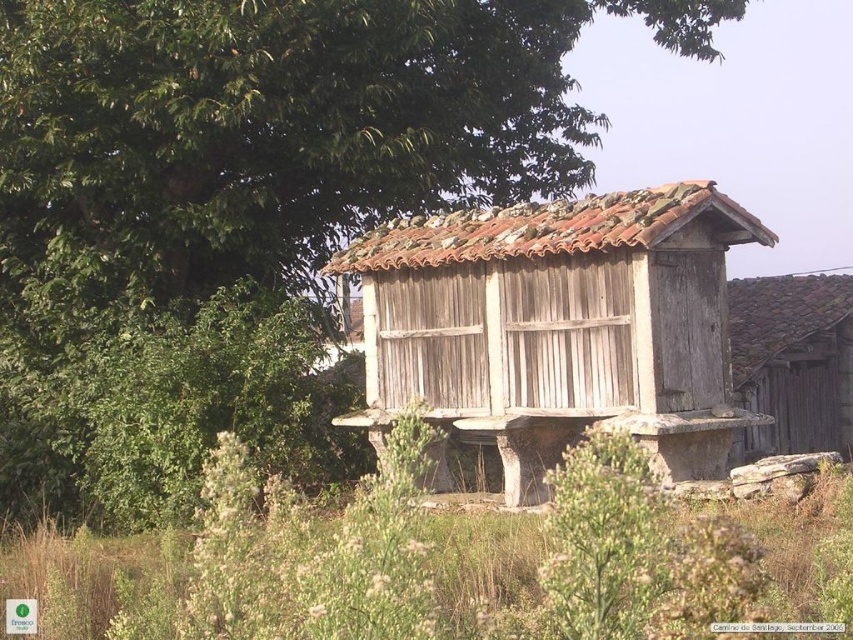
Is weathered wood hut at center closer to the viewer compared to wooden barn at right?

Yes, it is in front of wooden barn at right.

Is point (442, 266) positioned in front of point (747, 440)?

Yes, it is.

Is point (693, 280) behind point (741, 376)?

No.

Where is `weathered wood hut at center`? This screenshot has height=640, width=853. weathered wood hut at center is located at coordinates (558, 324).

Does green leafy tree at upper left appear under wooden barn at right?

No.

Does point (437, 125) come in front of point (772, 390)?

Yes, point (437, 125) is in front of point (772, 390).

Looking at this image, measure the distance between green leafy tree at upper left and camera.

green leafy tree at upper left is 12.10 meters from camera.

The width and height of the screenshot is (853, 640). Find the location of `green leafy tree at upper left`. green leafy tree at upper left is located at coordinates (268, 138).

Between point (466, 154) and point (662, 348), which one is positioned in front?

Point (662, 348)

Is green leafy tree at upper left wider than weathered wood hut at center?

Yes.

What do you see at coordinates (268, 138) in the screenshot?
I see `green leafy tree at upper left` at bounding box center [268, 138].

Locate an element on the screen. green leafy tree at upper left is located at coordinates (268, 138).